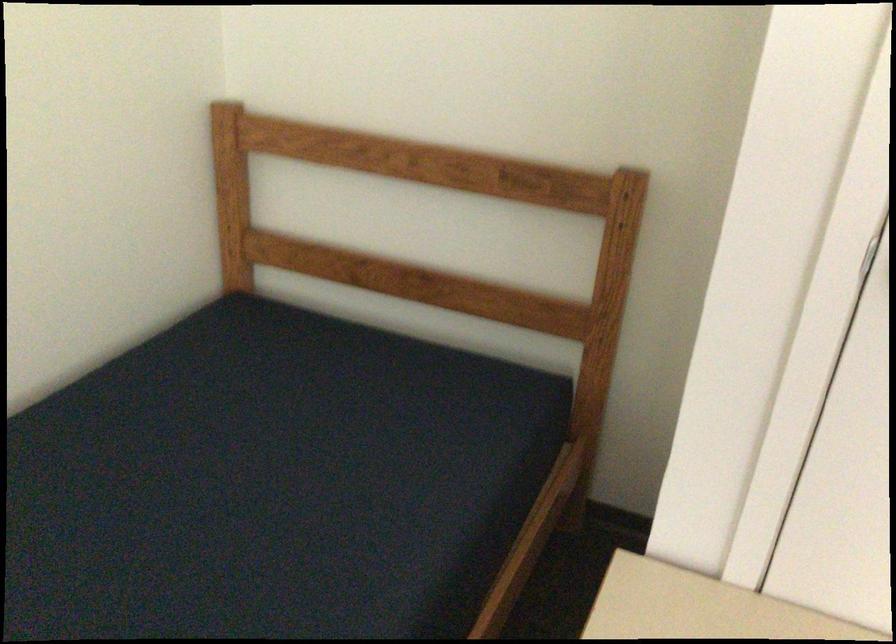
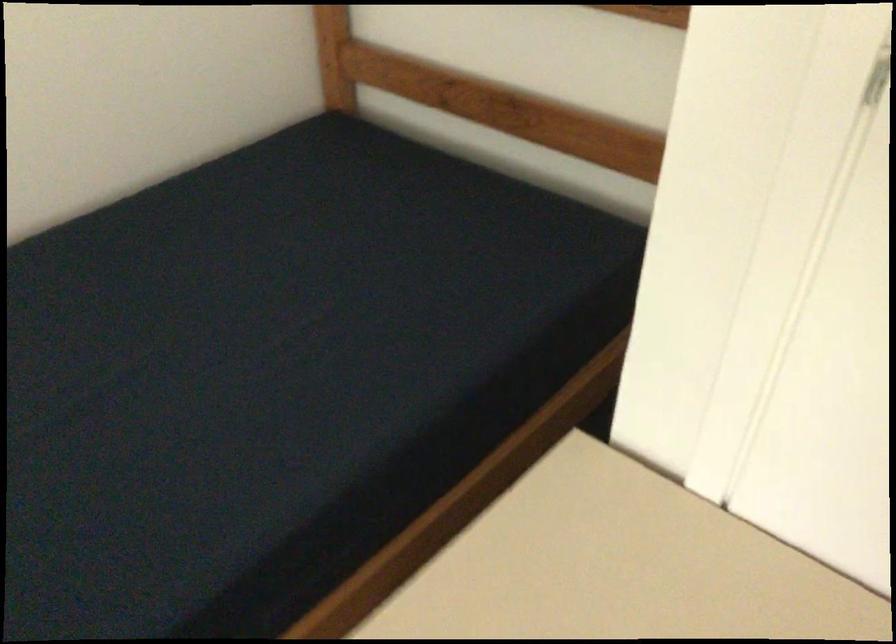
Question: The camera is either moving clockwise (left) or counter-clockwise (right) around the object. The first image is from the beginning of the video and the second image is from the end. Is the camera moving left or right when shooting the video?

Choices:
 (A) Left
 (B) Right

Answer: (B)